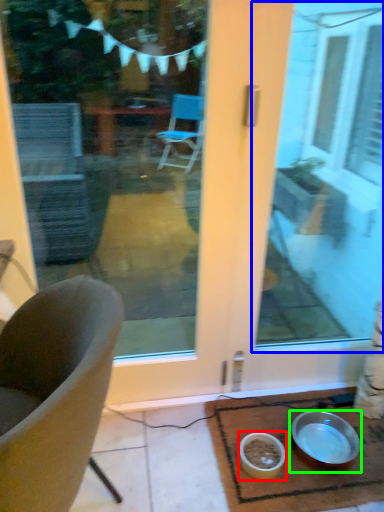
Question: Considering the real-world distances, which object is farthest from bowl (highlighted by a red box)? window screen (highlighted by a blue box) or bowl (highlighted by a green box)?

Choices:
 (A) window screen
 (B) bowl

Answer: (A)